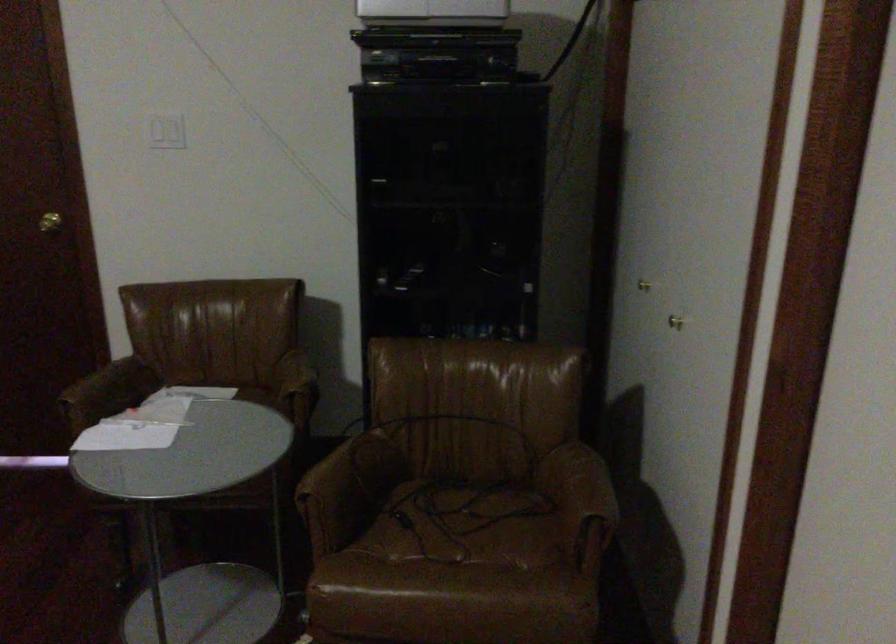
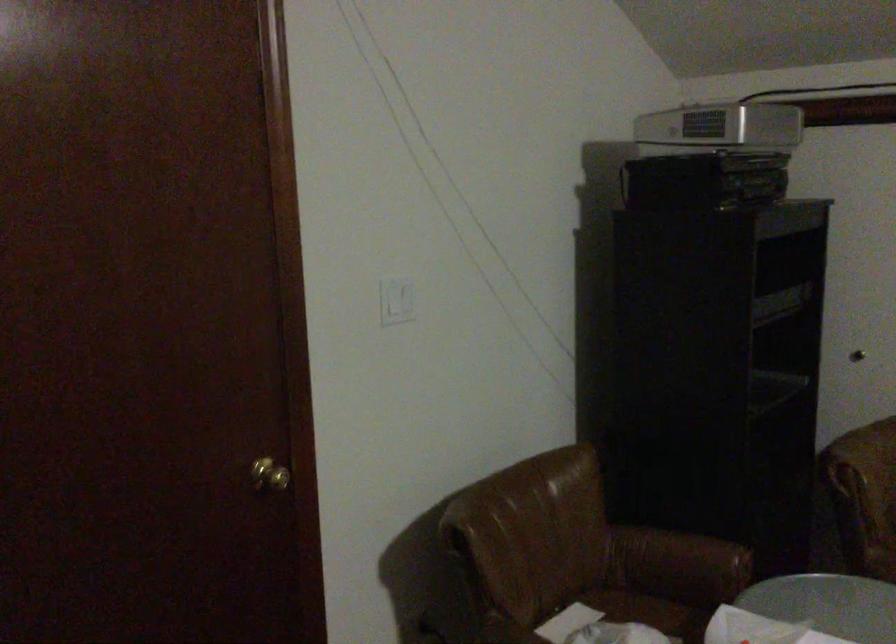
In the second image, find the point that corresponds to pixel 289 383 in the first image.

(679, 559)